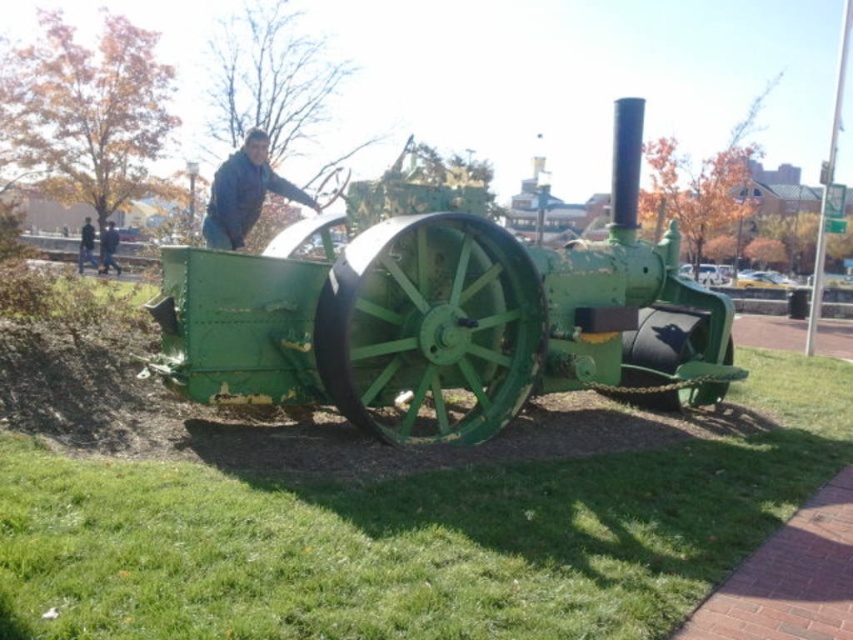
Based on the photo, you are standing at the point labeled point [91,227] and want to walk to the point labeled point [496,298]. Which direction should you face to move towards your destination?

You should face north because point [496,298] is in front of point [91,227], indicating it is located north of your current position.

From the picture: You are standing in the park where the vintage steam tractor is displayed. You notice the green grass at lower left and the dark blue jeans at center. Which object is positioned lower in the image?

The green grass at lower left is located below the dark blue jeans at center, so it is positioned lower in the image.